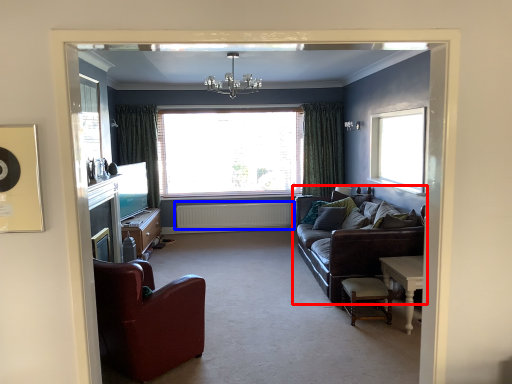
Question: Which object is further to the camera taking this photo, studio couch (highlighted by a red box) or radiator (highlighted by a blue box)?

Choices:
 (A) studio couch
 (B) radiator

Answer: (B)